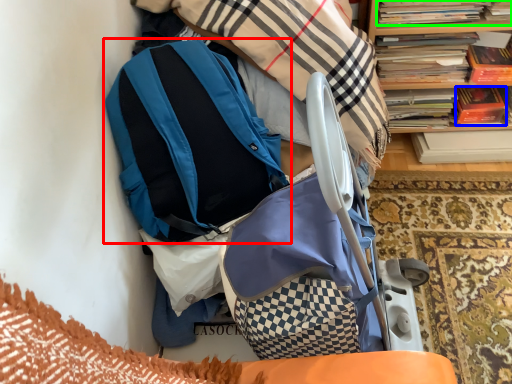
Question: Which is nearer to the backpack (highlighted by a red box)? paperback book (highlighted by a blue box) or book (highlighted by a green box).

Choices:
 (A) paperback book
 (B) book

Answer: (B)